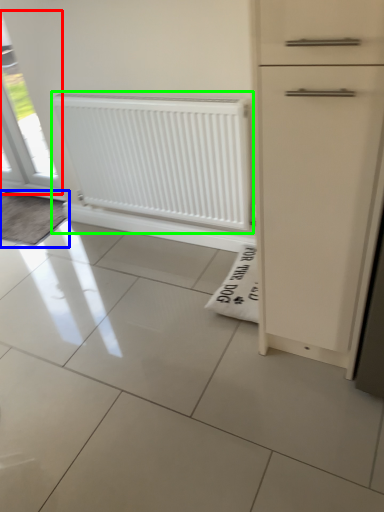
Question: Based on their relative distances, which object is nearer to window (highlighted by a red box)? Choose from doormat (highlighted by a blue box) and radiator (highlighted by a green box).

Choices:
 (A) doormat
 (B) radiator

Answer: (A)